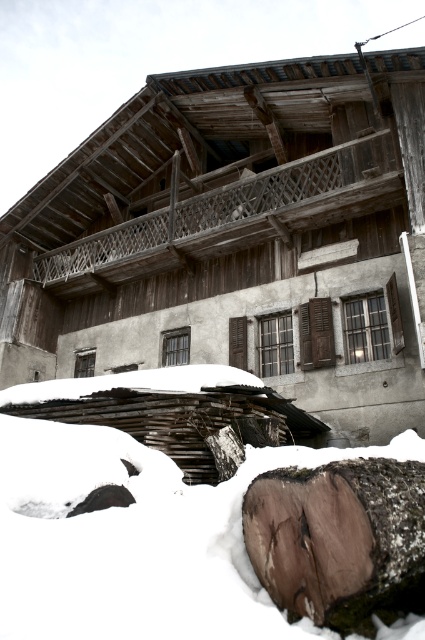
Is wooden log cabin at center bigger than white fluffy snow at lower left?

Yes, wooden log cabin at center is bigger than white fluffy snow at lower left.

Is wooden log cabin at center wider than white fluffy snow at lower left?

Yes.

Is point (209, 257) closer to viewer compared to point (39, 513)?

That is False.

The image size is (425, 640). I want to click on wooden log cabin at center, so click(238, 237).

Between wooden log cabin at center and brown rough wood at lower center, which one appears on the right side from the viewer's perspective?

brown rough wood at lower center is more to the right.

Does wooden log cabin at center have a larger size compared to brown rough wood at lower center?

Yes.

Is point (101, 321) in front of point (312, 605)?

No.

Where is `wooden log cabin at center`? Image resolution: width=425 pixels, height=640 pixels. wooden log cabin at center is located at coordinates (238, 237).

In the scene shown: Between white fluffy snow at lower left and brown rough wood at lower center, which one has less height?

Standing shorter between the two is white fluffy snow at lower left.

Is point (5, 624) positioned before point (345, 516)?

That is True.

Is point (104, 525) positioned behind point (351, 497)?

Yes, point (104, 525) is farther from viewer.

The width and height of the screenshot is (425, 640). Identify the location of white fluffy snow at lower left. (136, 540).